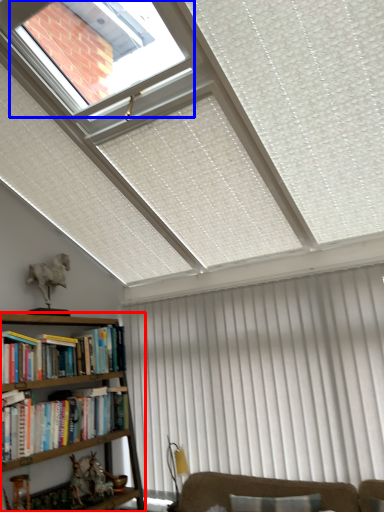
Question: Which point is closer to the camera, bookcase (highlighted by a red box) or bay window (highlighted by a blue box)?

Choices:
 (A) bookcase
 (B) bay window

Answer: (B)